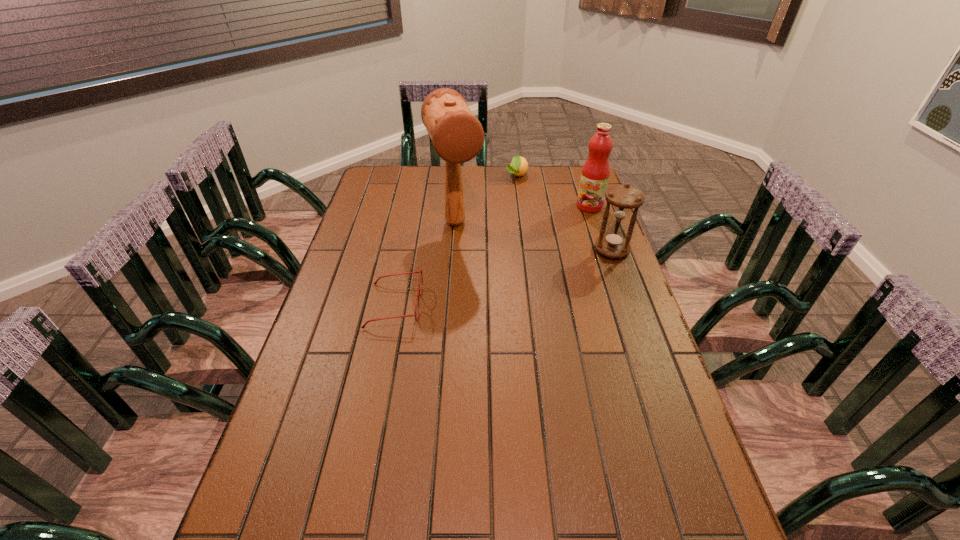
Where is `object that is the fourth closest to the hourglass`? This screenshot has height=540, width=960. object that is the fourth closest to the hourglass is located at coordinates (420, 271).